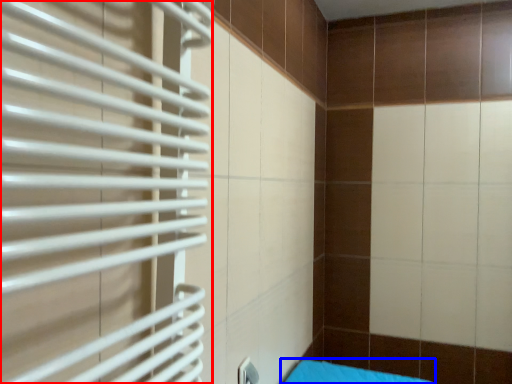
Question: Which of the following is the closest to the observer, shutter (highlighted by a red box) or furniture (highlighted by a blue box)?

Choices:
 (A) shutter
 (B) furniture

Answer: (A)